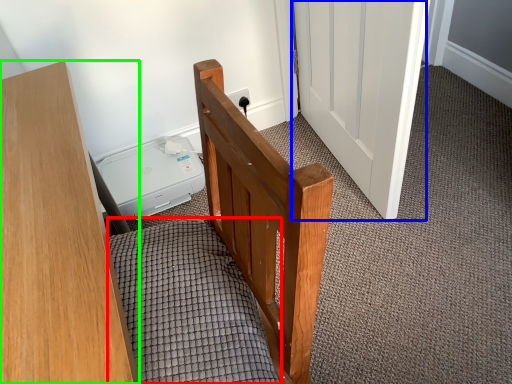
Question: Which object is positioned farthest from bedding (highlighted by a red box)? Select from door (highlighted by a blue box) and furniture (highlighted by a green box).

Choices:
 (A) door
 (B) furniture

Answer: (A)